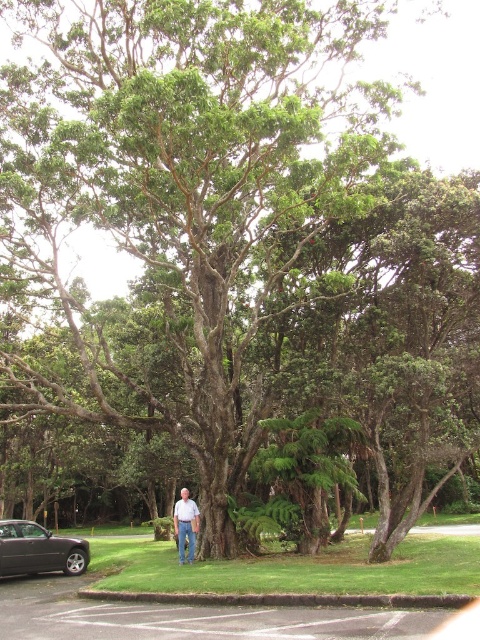
From the picture: Can you confirm if dark gray metallic car at lower left is positioned below white cotton shirt at center?

Indeed, dark gray metallic car at lower left is positioned under white cotton shirt at center.

Between dark gray metallic car at lower left and white cotton shirt at center, which one appears on the left side from the viewer's perspective?

Positioned to the left is dark gray metallic car at lower left.

Between point (3, 525) and point (182, 509), which one is positioned in front?

Point (3, 525)

This screenshot has width=480, height=640. What are the coordinates of `dark gray metallic car at lower left` in the screenshot? It's located at (x=38, y=550).